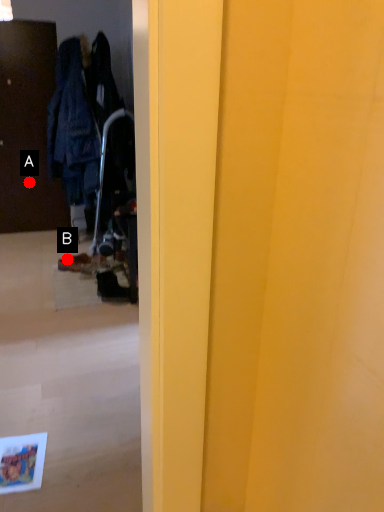
Question: Two points are circled on the image, labeled by A and B beside each circle. Among these points, which one is nearest to the camera?

Choices:
 (A) A is closer
 (B) B is closer

Answer: (B)